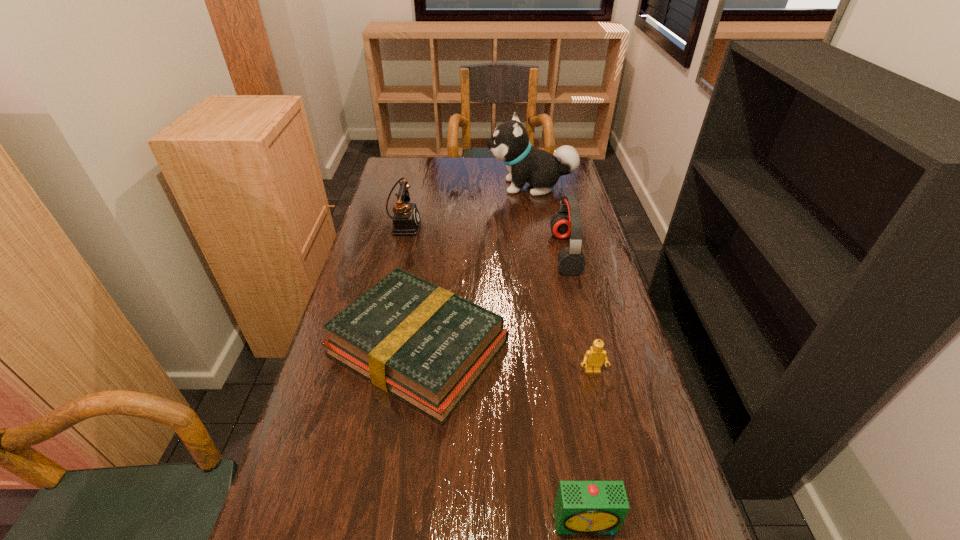
This screenshot has width=960, height=540. I want to click on vacant area that lies between the tallest object and the hardback book, so click(474, 267).

Identify the location of vacant space that's between the Lego and the telephone. This screenshot has height=540, width=960. (498, 298).

In order to click on vacant area between the nearest object and the Lego in this screenshot , I will do `click(589, 447)`.

I want to click on free space between the third tallest object and the fifth shortest object, so 485,239.

Find the location of a particular element. This screenshot has width=960, height=540. vacant area between the alarm clock and the farthest object is located at coordinates coord(559,354).

Where is `free space between the nearest object and the hardback book`? The image size is (960, 540). free space between the nearest object and the hardback book is located at coordinates [x=502, y=435].

Image resolution: width=960 pixels, height=540 pixels. Identify the location of vacant space that is in between the third tallest object and the Lego. (498, 298).

Locate an element on the screen. Image resolution: width=960 pixels, height=540 pixels. object that is the second closest to the Lego is located at coordinates (581, 507).

You are a GUI agent. You are given a task and a screenshot of the screen. Output one action in this format:
    pyautogui.click(x=<x>, y=<y>)
    Task: Click on the second closest object to the nearest object
    The image size is (960, 540).
    Given the screenshot: What is the action you would take?
    pyautogui.click(x=594, y=357)

Image resolution: width=960 pixels, height=540 pixels. What are the coordinates of `free location that satisfies the following two spatial constraints: 1. on the front of the telephone at the rotary dial; 2. on the right side of the hardback book` in the screenshot? It's located at (375, 348).